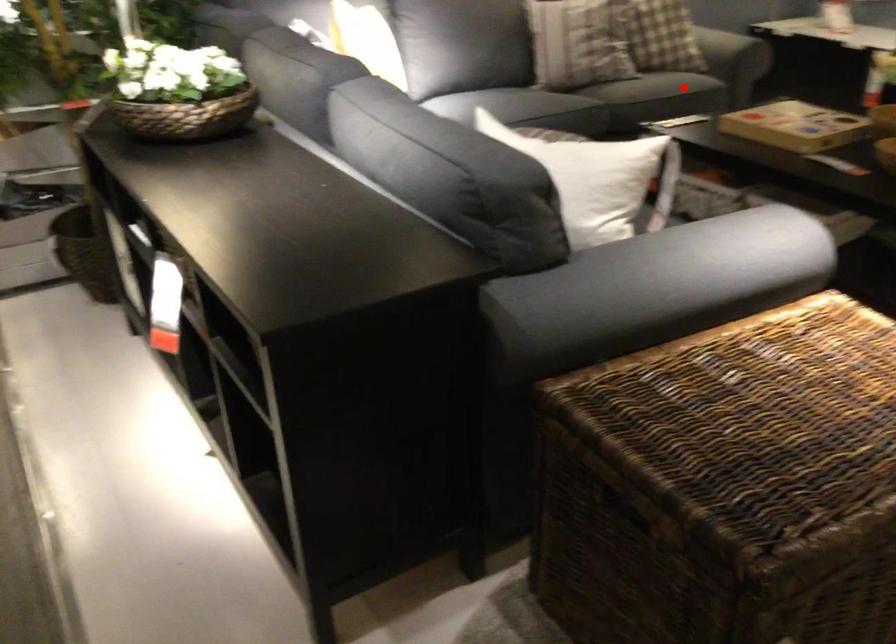
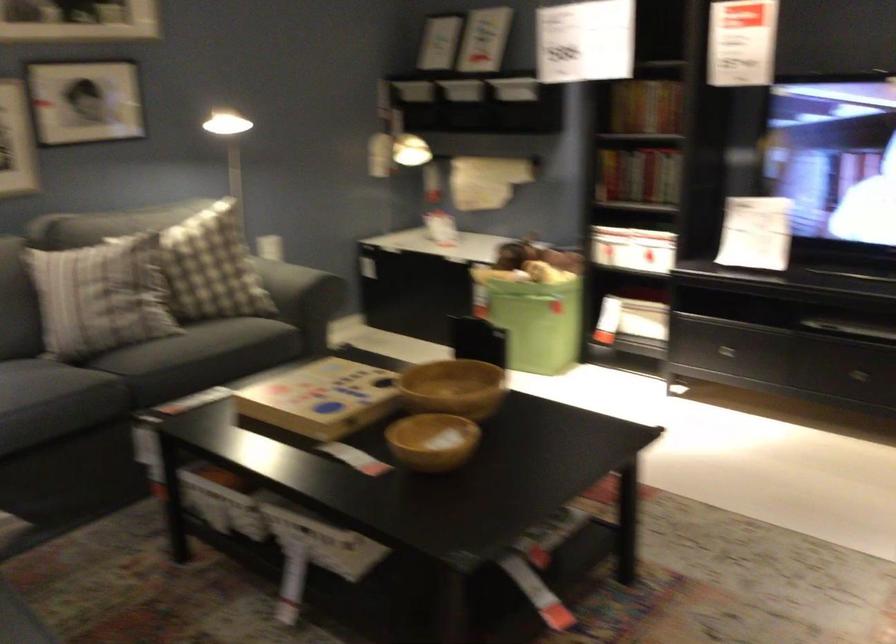
Where in the second image is the point corresponding to the highlighted location from the first image?

(199, 357)